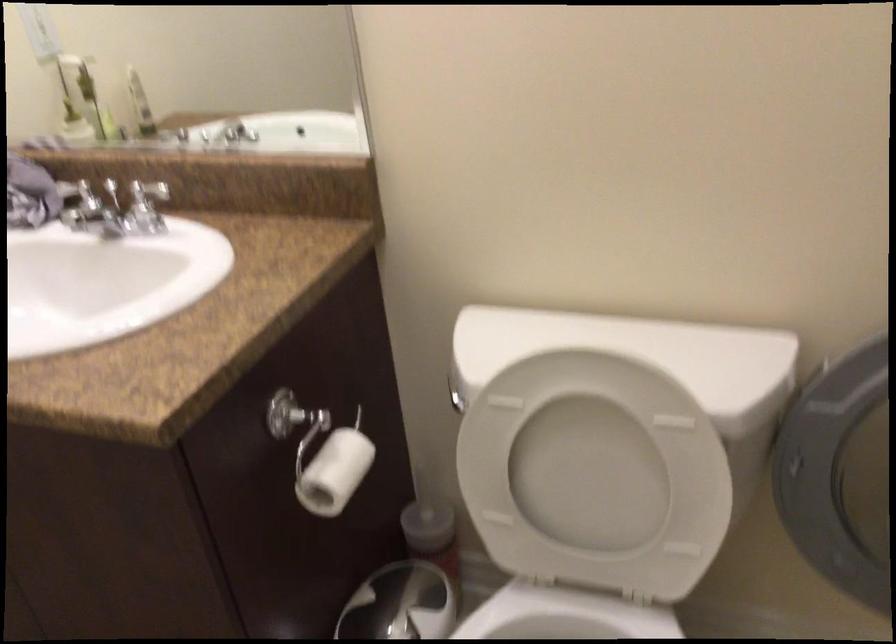
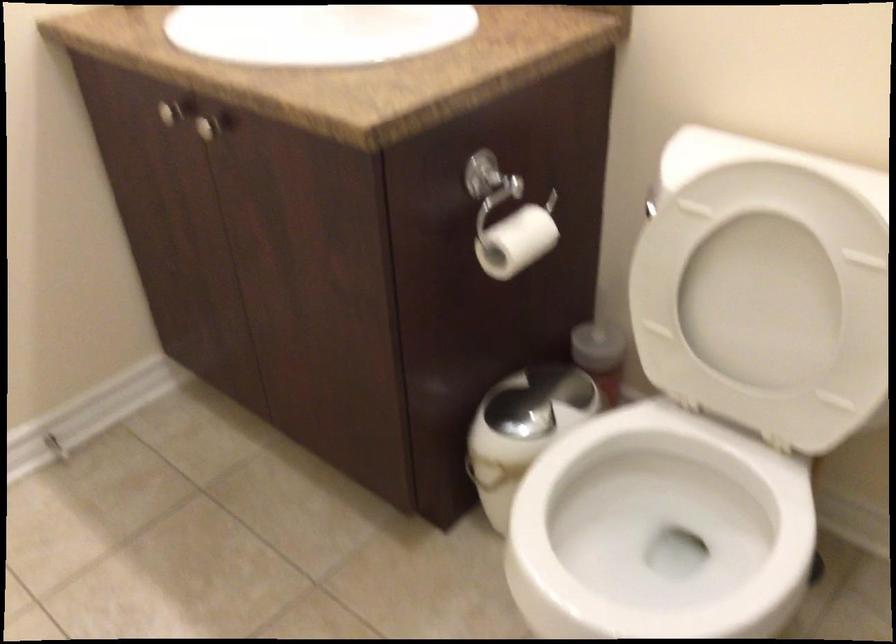
Locate, in the second image, the point that corresponds to the point at 340,474 in the first image.

(515, 242)